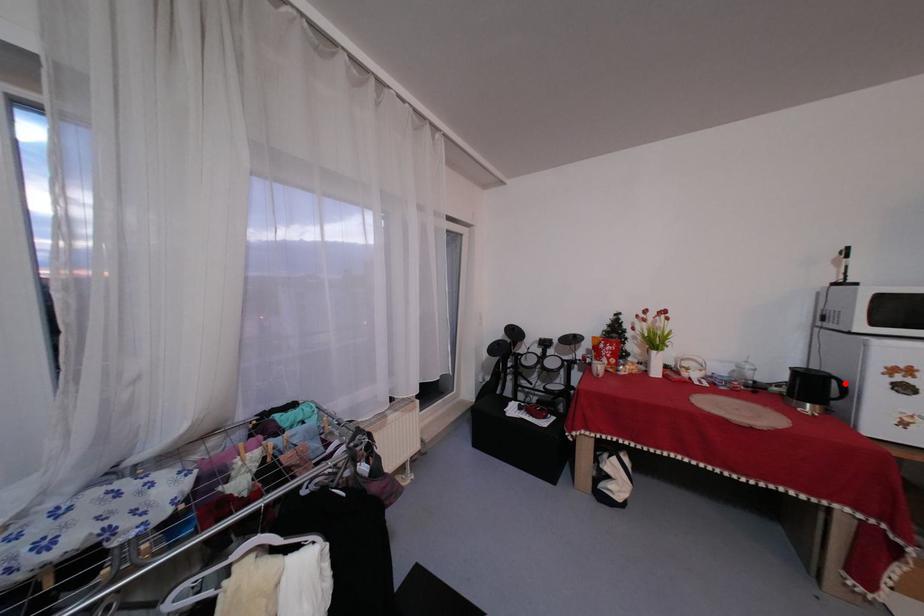
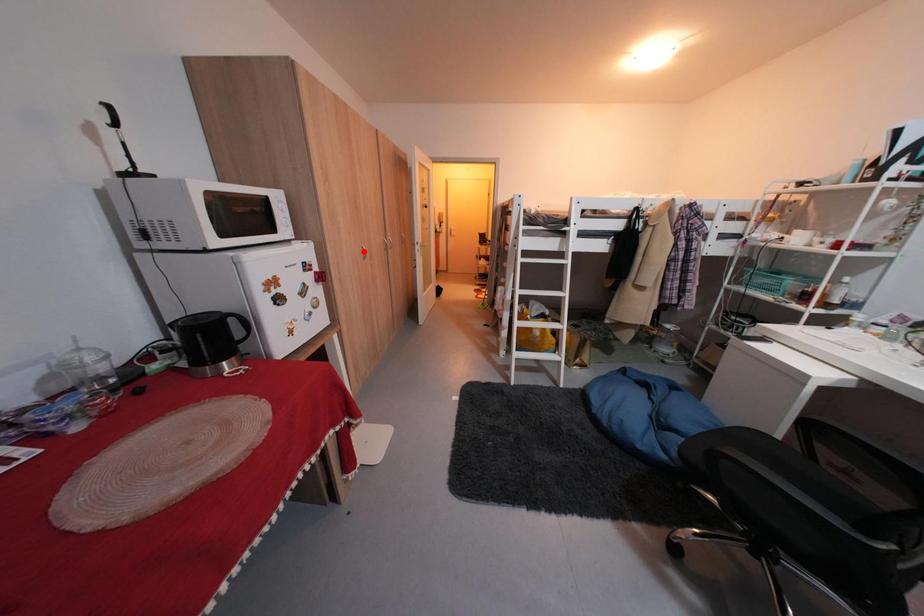
I am providing you with two images of the same scene from different viewpoints. A red point is marked on the first image and another point is marked on the second image. Does the point marked in image1 correspond to the same location as the one in image2?

No